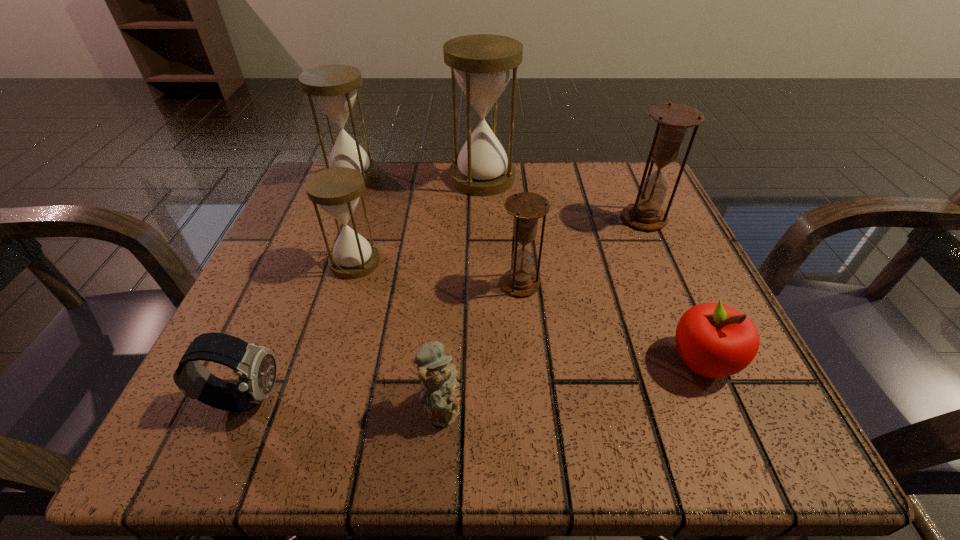
This screenshot has width=960, height=540. I want to click on the tallest hourglass, so click(x=482, y=64).

I want to click on the tallest object, so click(x=482, y=64).

Locate an element on the screen. The width and height of the screenshot is (960, 540). the second smallest white hourglass is located at coordinates (334, 88).

Identify the location of the third nearest hourglass. (673, 120).

You are a GUI agent. You are given a task and a screenshot of the screen. Output one action in this format:
    pyautogui.click(x=<x>, y=<y>)
    Task: Click on the right brown hourglass
    The height and width of the screenshot is (540, 960).
    Given the screenshot: What is the action you would take?
    pyautogui.click(x=673, y=120)

Find the location of `the smaller brown hourglass`. the smaller brown hourglass is located at coordinates (520, 280).

At what (x,y) coordinates should I click in order to perform the action: click on the left brown hourglass. Please return your answer as a coordinate pair (x, y). Image resolution: width=960 pixels, height=540 pixels. Looking at the image, I should click on (520, 280).

I want to click on the smallest white hourglass, so click(x=337, y=190).

The width and height of the screenshot is (960, 540). What are the coordinates of `blue teddy bear` in the screenshot? It's located at (438, 393).

This screenshot has width=960, height=540. I want to click on apple, so point(714,340).